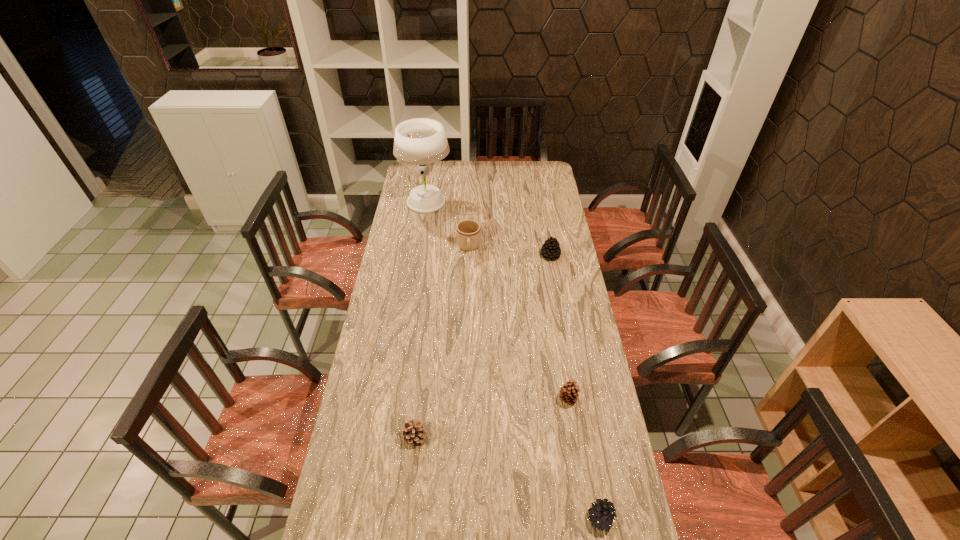
Locate an element on the screen. the farthest object is located at coordinates (421, 141).

This screenshot has height=540, width=960. In order to click on lamp in this screenshot , I will do `click(421, 141)`.

Locate an element on the screen. mug is located at coordinates (468, 231).

Where is `the farthest pinecone`? The width and height of the screenshot is (960, 540). the farthest pinecone is located at coordinates (551, 249).

Identify the location of the third nearest object. (569, 392).

At what (x,y) coordinates should I click in order to perform the action: click on the nearest pinecone. Please return your answer as a coordinate pair (x, y). Looking at the image, I should click on (602, 514).

This screenshot has width=960, height=540. Identify the location of the second nearest pinecone. (413, 433).

Where is `the fifth farthest object`? the fifth farthest object is located at coordinates (413, 433).

Find the location of `vacant space located on the front-facing side of the tallest object`. vacant space located on the front-facing side of the tallest object is located at coordinates (496, 203).

Identify the location of vacant area situated on the side of the fourth object from right to left with the handle. (468, 268).